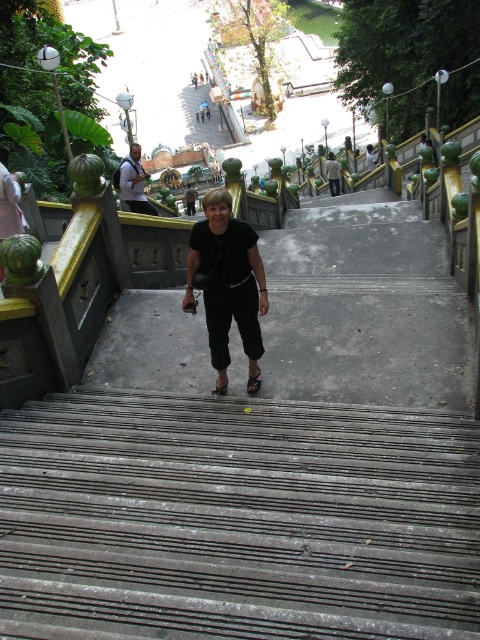
Is rusty metal stairs at center shorter than blonde hair at center?

Yes, rusty metal stairs at center is shorter than blonde hair at center.

Consider the image. Does rusty metal stairs at center have a smaller size compared to blonde hair at center?

Incorrect, rusty metal stairs at center is not smaller in size than blonde hair at center.

Is point (296, 540) closer to viewer compared to point (211, 212)?

Yes, point (296, 540) is closer to viewer.

Where is `rusty metal stairs at center`? Image resolution: width=480 pixels, height=640 pixels. rusty metal stairs at center is located at coordinates (236, 518).

Is rusty metal stairs at center further to the viewer compared to matte black hair at center?

That is False.

Does rusty metal stairs at center have a larger size compared to matte black hair at center?

No.

Between point (249, 577) and point (140, 145), which one is positioned in front?

Point (249, 577)

Find the location of a particular element. This screenshot has height=640, width=480. rusty metal stairs at center is located at coordinates (236, 518).

Is blonde hair at center to the right of matte black hair at center from the viewer's perspective?

Yes, blonde hair at center is to the right of matte black hair at center.

Is blonde hair at center smaller than matte black hair at center?

Yes.

Is point (216, 208) closer to viewer compared to point (139, 150)?

Yes, point (216, 208) is in front of point (139, 150).

Where is `blonde hair at center`? Image resolution: width=480 pixels, height=640 pixels. blonde hair at center is located at coordinates (216, 209).